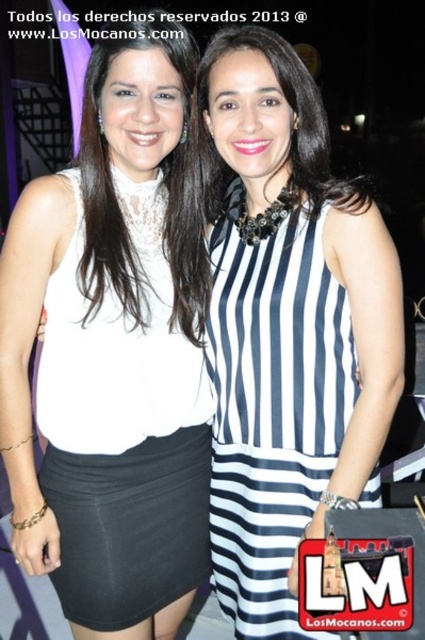
Does white lace dress at left have a smaller size compared to navy blue striped dress at center?

Yes.

Who is positioned more to the right, white lace dress at left or navy blue striped dress at center?

Positioned to the right is navy blue striped dress at center.

This screenshot has height=640, width=425. I want to click on white lace dress at left, so click(x=124, y=429).